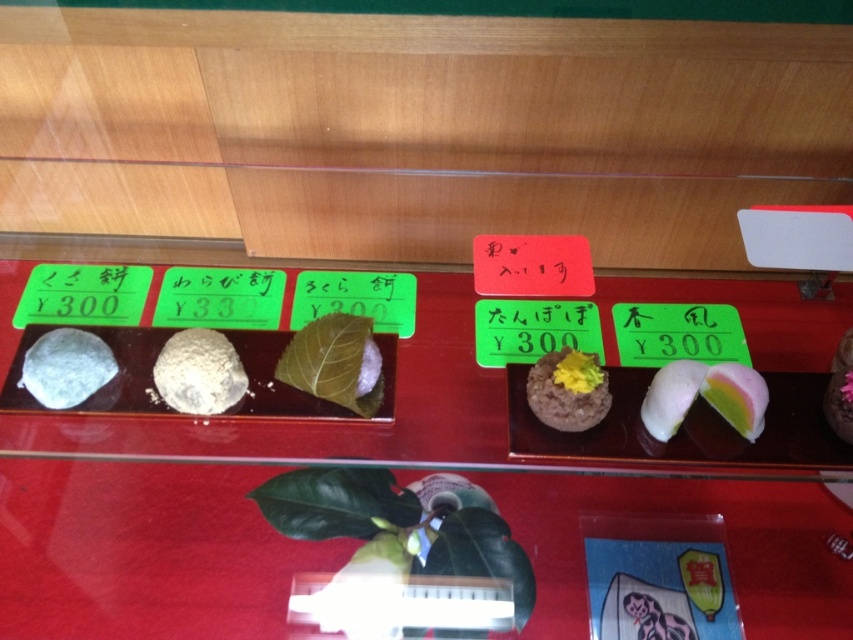
You are a customer looking at the display case of Japanese sweets. You see the white matte rice ball at center and the smooth brown rice cake with yellow topping at center. Which one is positioned to the left?

The white matte rice ball at center is positioned to the left of the smooth brown rice cake with yellow topping at center.

You are a customer at a Japanese sweet shop looking at the display case. You see the white matte rice ball at center and the smooth brown rice cake with yellow topping at center. Which one is placed higher in the display case?

The white matte rice ball at center is positioned over the smooth brown rice cake with yellow topping at center, so it is placed higher in the display case.

You are a customer at the display case and want to pick up the item closest to you. Which point between point (676, 417) and point (842, 436) should you reach for?

Point (676, 417) is closer to the camera than point (842, 436), so you should reach for point (676, 417).